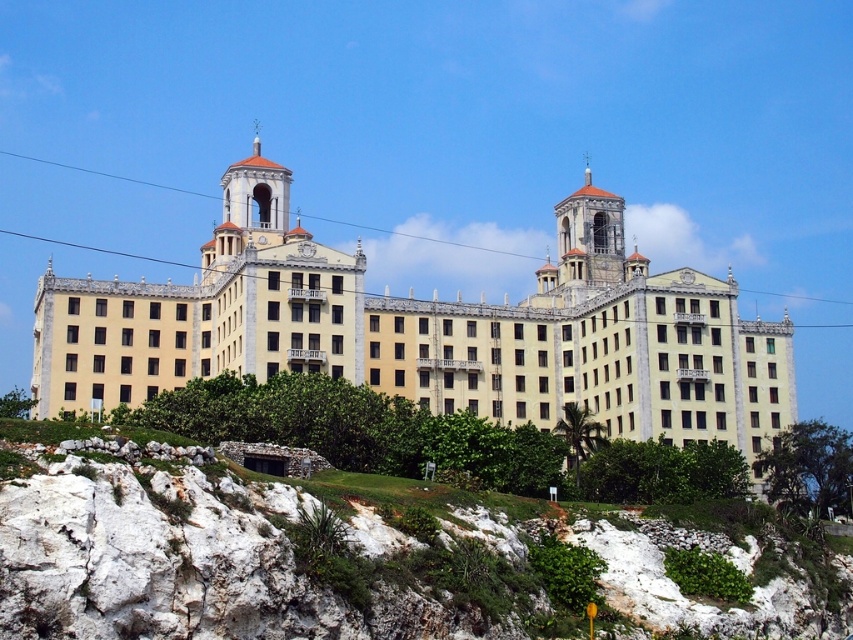
Measure the distance between point (573, 218) and camera.

113.13 meters

Between point (584, 260) and point (270, 227), which one is positioned behind?

Positioned behind is point (584, 260).

Who is more distant from viewer, (x=579, y=264) or (x=283, y=208)?

The point (x=579, y=264) is behind.

Find the location of a particular element. This screenshot has width=853, height=640. smooth stone tower at upper center is located at coordinates (590, 236).

Who is more distant from viewer, (541, 340) or (590, 266)?

The point (590, 266) is behind.

Is beige stone building at center above smooth stone tower at upper center?

Incorrect, beige stone building at center is not positioned above smooth stone tower at upper center.

Identify the location of beige stone building at center. (426, 340).

Find the location of a particular element. Image resolution: width=853 pixels, height=640 pixels. beige stone building at center is located at coordinates (426, 340).

Between beige stone building at center and smooth beige dome at center, which one appears on the left side from the viewer's perspective?

From the viewer's perspective, smooth beige dome at center appears more on the left side.

Who is more distant from viewer, (670, 403) or (283, 179)?

Point (283, 179)

This screenshot has height=640, width=853. What are the coordinates of `beige stone building at center` in the screenshot? It's located at (426, 340).